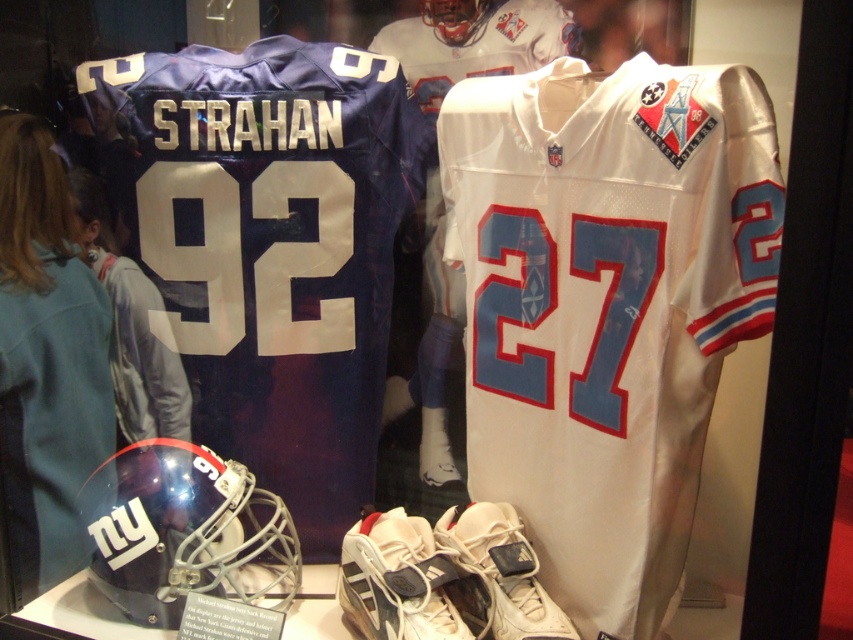
Question: Considering the real-world distances, which object is closest to the white leather shoe at center?

Choices:
 (A) blue fabric helmet at lower left
 (B) white leather shoe at lower center
 (C) light blue fabric at center

Answer: (B)

Question: Among these points, which one is farthest from the camera?

Choices:
 (A) (132, 577)
 (B) (358, 65)

Answer: (B)

Question: Can you confirm if white fabric at center is thinner than white leather shoe at lower center?

Choices:
 (A) yes
 (B) no

Answer: (B)

Question: Where is light blue fabric at center located in relation to white leather shoe at center in the image?

Choices:
 (A) below
 (B) above

Answer: (B)

Question: Which is nearer to the matte blue jersey at upper left?

Choices:
 (A) matte blue jersey at upper center
 (B) shiny blue helmet at lower left
 (C) white leather shoe at center
 (D) light blue fabric at center

Answer: (A)

Question: Is white fabric at center thinner than glossy plastic helmet at upper center?

Choices:
 (A) yes
 (B) no

Answer: (B)